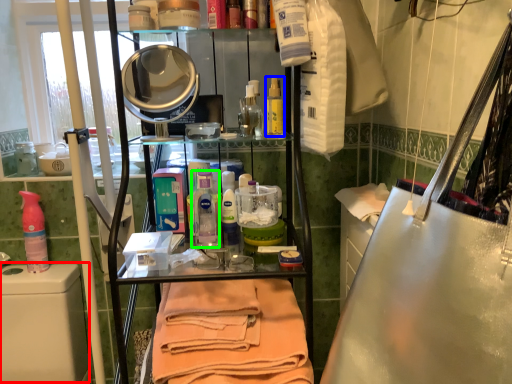
Question: Estimate the real-world distances between objects in this image. Which object is farther from washing (highlighted by a red box), mouthwash (highlighted by a blue box) or cleaning product (highlighted by a green box)?

Choices:
 (A) mouthwash
 (B) cleaning product

Answer: (A)